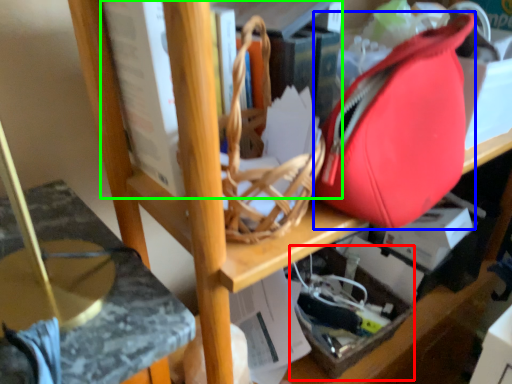
Question: Which is nearer to the box (highlighted by a red box)? tote bag (highlighted by a blue box) or book (highlighted by a green box).

Choices:
 (A) tote bag
 (B) book

Answer: (A)